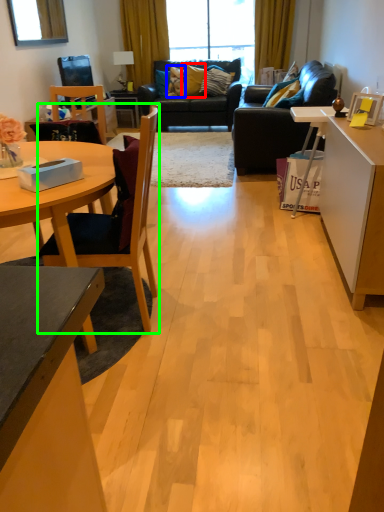
Question: Estimate the real-world distances between objects in this image. Which object is closer to pillow (highlighted by a red box), pillow (highlighted by a blue box) or chair (highlighted by a green box)?

Choices:
 (A) pillow
 (B) chair

Answer: (A)